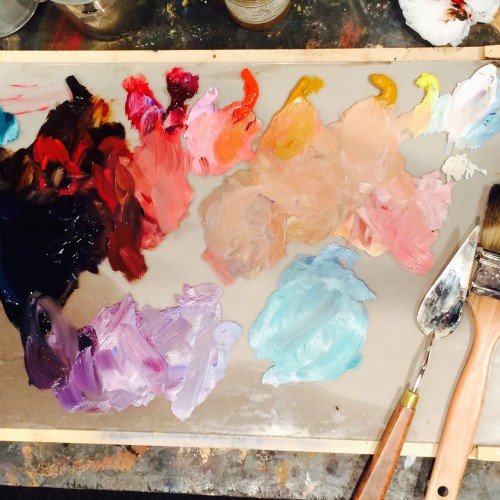
Where is `orange paint`? Image resolution: width=500 pixels, height=500 pixels. orange paint is located at coordinates (276, 134).